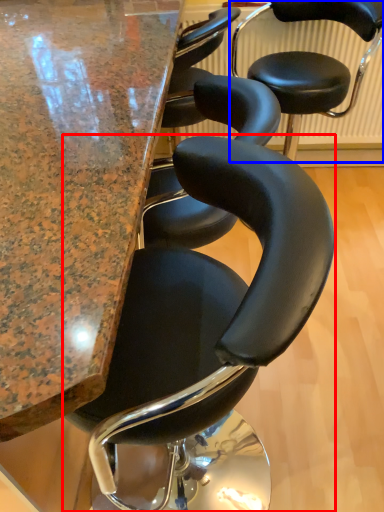
Question: Which point is closer to the camera, chair (highlighted by a red box) or chair (highlighted by a blue box)?

Choices:
 (A) chair
 (B) chair

Answer: (A)